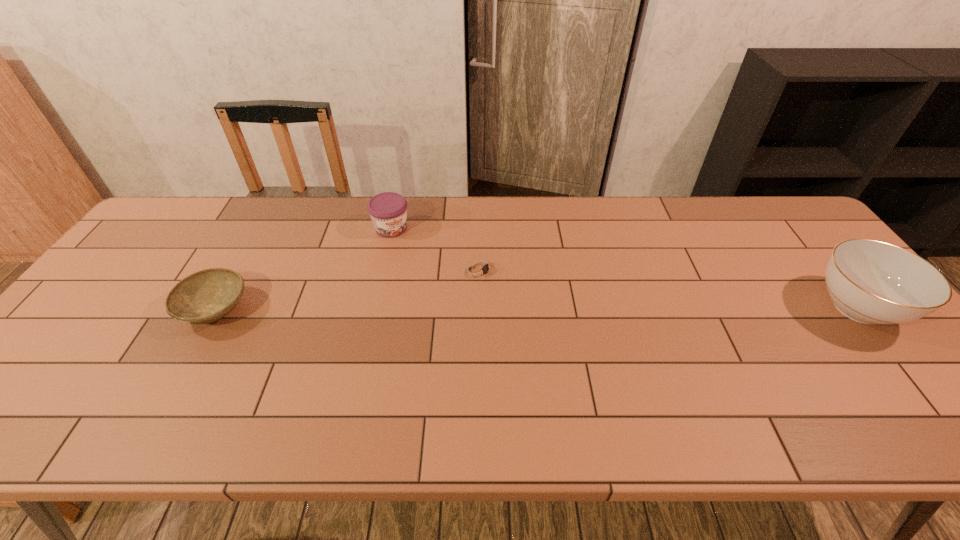
The height and width of the screenshot is (540, 960). Identify the location of free space on the desktop that is between the leftmost object and the rightmost object and is positioned on the face of the third object from left to right. (562, 308).

The width and height of the screenshot is (960, 540). Find the location of `free space on the desktop that is between the second shortest object and the chinaware and is positioned on the front label of the jam`. free space on the desktop that is between the second shortest object and the chinaware and is positioned on the front label of the jam is located at coordinates (451, 309).